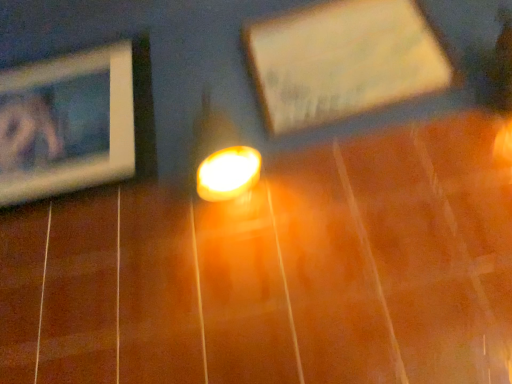
Question: Could wooden picture frame at left, the 2th picture frame when ordered from right to left, be considered to be inside wooden picture frame at upper center, which is the second picture frame from left to right?

Choices:
 (A) yes
 (B) no

Answer: (B)

Question: Considering the relative sizes of wooden picture frame at upper center, marked as the first picture frame in a right-to-left arrangement, and wooden picture frame at left, placed as the first picture frame when sorted from left to right, in the image provided, is wooden picture frame at upper center, marked as the first picture frame in a right-to-left arrangement, thinner than wooden picture frame at left, placed as the first picture frame when sorted from left to right,?

Choices:
 (A) no
 (B) yes

Answer: (A)

Question: From the image's perspective, is wooden picture frame at upper center, which is the second picture frame from left to right, located above wooden picture frame at left, placed as the first picture frame when sorted from left to right?

Choices:
 (A) no
 (B) yes

Answer: (B)

Question: From the image's perspective, does wooden picture frame at upper center, marked as the first picture frame in a right-to-left arrangement, appear lower than wooden picture frame at left, the 2th picture frame when ordered from right to left?

Choices:
 (A) yes
 (B) no

Answer: (B)

Question: From a real-world perspective, is wooden picture frame at upper center, marked as the first picture frame in a right-to-left arrangement, under wooden picture frame at left, placed as the first picture frame when sorted from left to right?

Choices:
 (A) yes
 (B) no

Answer: (A)

Question: From a real-world perspective, is wooden picture frame at upper center, marked as the first picture frame in a right-to-left arrangement, over wooden picture frame at left, placed as the first picture frame when sorted from left to right?

Choices:
 (A) no
 (B) yes

Answer: (A)

Question: Can you see wooden picture frame at left, the 2th picture frame when ordered from right to left, touching wooden picture frame at upper center, marked as the first picture frame in a right-to-left arrangement?

Choices:
 (A) no
 (B) yes

Answer: (A)

Question: Is wooden picture frame at left, the 2th picture frame when ordered from right to left, taller than wooden picture frame at upper center, which is the second picture frame from left to right?

Choices:
 (A) no
 (B) yes

Answer: (B)

Question: Can you confirm if wooden picture frame at left, placed as the first picture frame when sorted from left to right, is smaller than wooden picture frame at upper center, which is the second picture frame from left to right?

Choices:
 (A) yes
 (B) no

Answer: (B)

Question: Does wooden picture frame at left, placed as the first picture frame when sorted from left to right, lie behind wooden picture frame at upper center, which is the second picture frame from left to right?

Choices:
 (A) no
 (B) yes

Answer: (B)

Question: Is wooden picture frame at left, placed as the first picture frame when sorted from left to right, turned away from wooden picture frame at upper center, which is the second picture frame from left to right?

Choices:
 (A) yes
 (B) no

Answer: (B)

Question: Is wooden picture frame at left, the 2th picture frame when ordered from right to left, wider than wooden picture frame at upper center, which is the second picture frame from left to right?

Choices:
 (A) no
 (B) yes

Answer: (A)

Question: Is point (61, 157) positioned closer to the camera than point (280, 74)?

Choices:
 (A) closer
 (B) farther

Answer: (A)